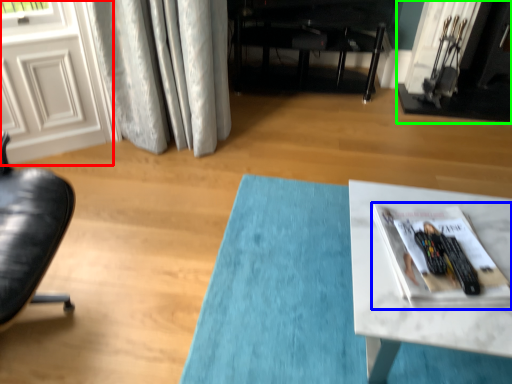
Question: Based on their relative distances, which object is farther from screen door (highlighted by a red box)? Choose from magazine (highlighted by a blue box) and fireplace (highlighted by a green box).

Choices:
 (A) magazine
 (B) fireplace

Answer: (B)